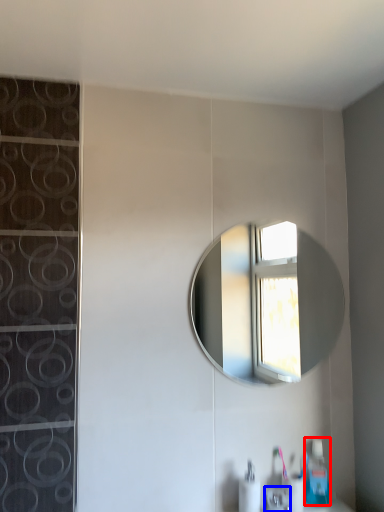
Question: Which object is closer to the camera taking this photo, soap dispenser (highlighted by a red box) or faucet (highlighted by a blue box)?

Choices:
 (A) soap dispenser
 (B) faucet

Answer: (B)